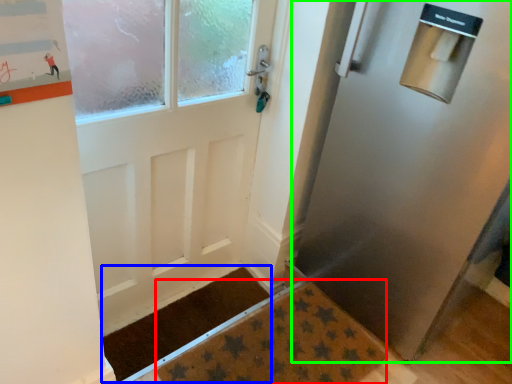
Question: Which is nearer to the doormat (highlighted by a red box)? doormat (highlighted by a blue box) or door (highlighted by a green box).

Choices:
 (A) doormat
 (B) door

Answer: (A)